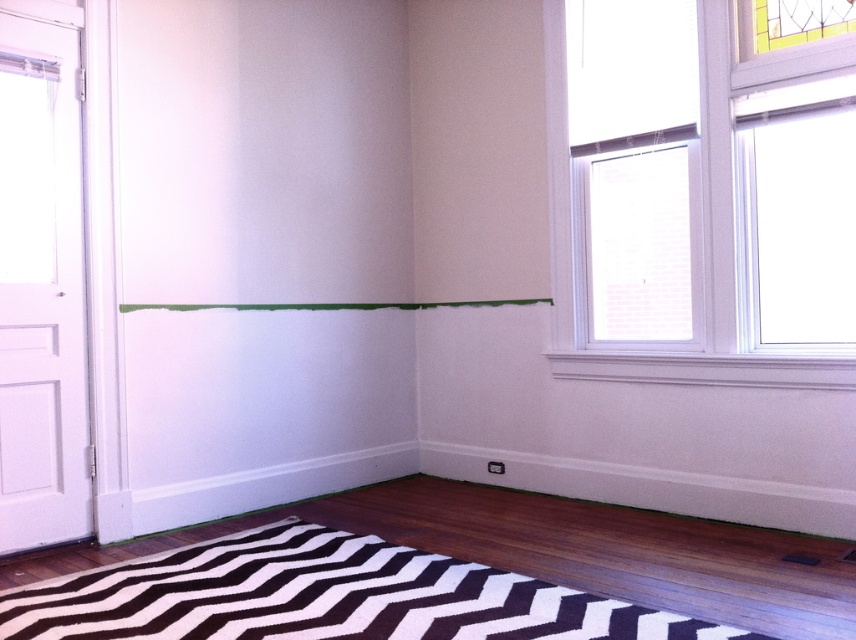
You are a painter standing in the room and need to reach the white glass window at upper right to clean it. Is the black and white zigzag rug at lower center in your way?

The black and white zigzag rug at lower center is below the white glass window at upper right, so it is not blocking your path to the window.

You are a painter who needs to move a ladder from the white glass window at upper right to the black and white zigzag rug at lower center. Considering the space, will the ladder fit through the area between them?

The black and white zigzag rug at lower center is wider than the white glass window at upper right, so the ladder can fit through the space between them as the rug provides sufficient width.

You are a painter standing in the room and need to move a ladder from the black and white zigzag rug at lower center to the white glass window at upper right. Can you estimate if the ladder will fit vertically between them without tilting?

The black and white zigzag rug at lower center is not as tall as the white glass window at upper right, so the ladder may not fit vertically between them if the rug is shorter. However, since the rug is on the floor and the window is higher up, the vertical space between them might accommodate the ladder depending on the ladder height and the distance between the rug and window. The description only compares their heights, not the vertical clearance between them.